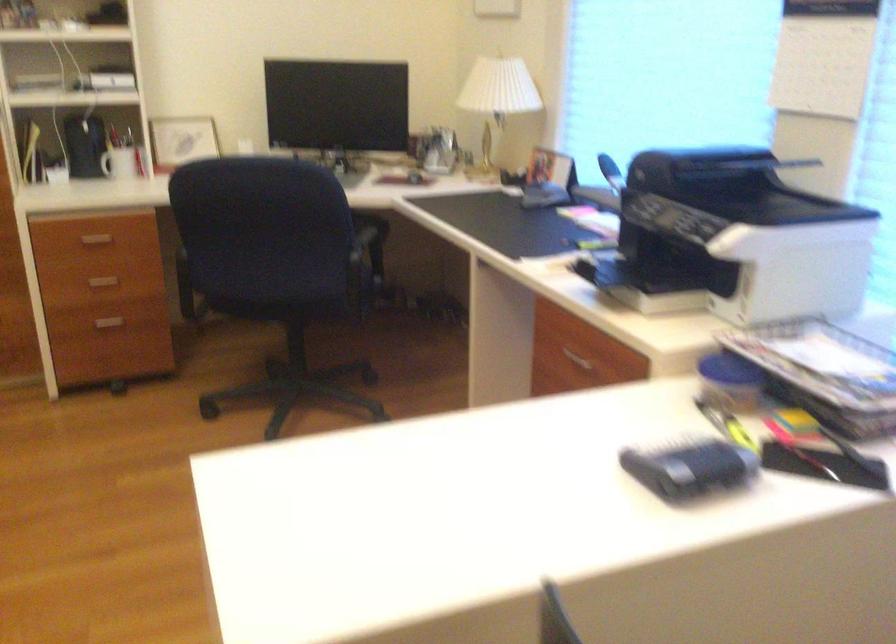
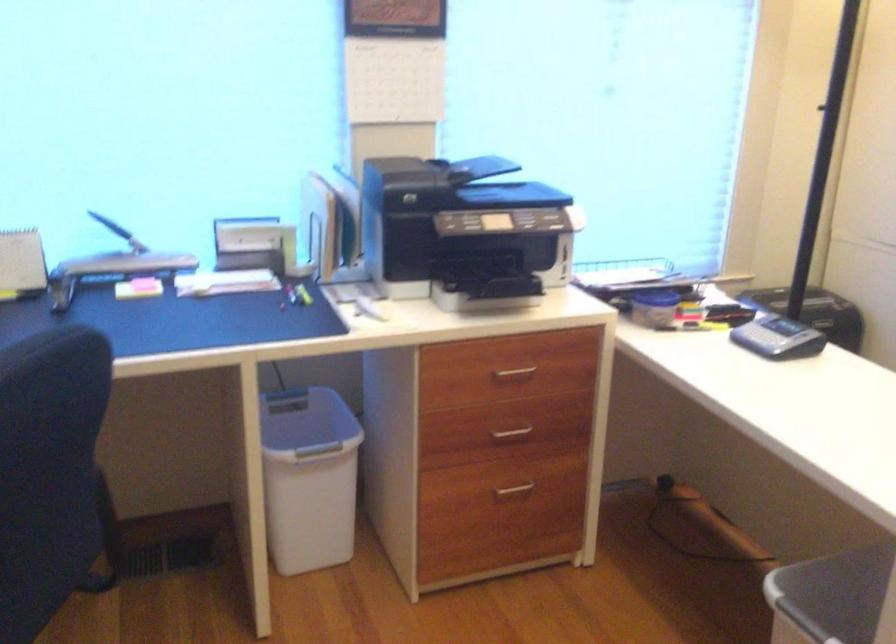
Where in the second image is the point corresponding to (x=691, y=464) from the first image?

(778, 337)